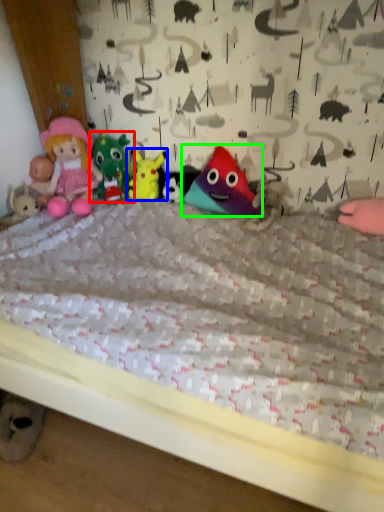
Question: Which object is the farthest from toy (highlighted by a red box)? Choose among these: toy (highlighted by a blue box) or toy (highlighted by a green box).

Choices:
 (A) toy
 (B) toy

Answer: (B)